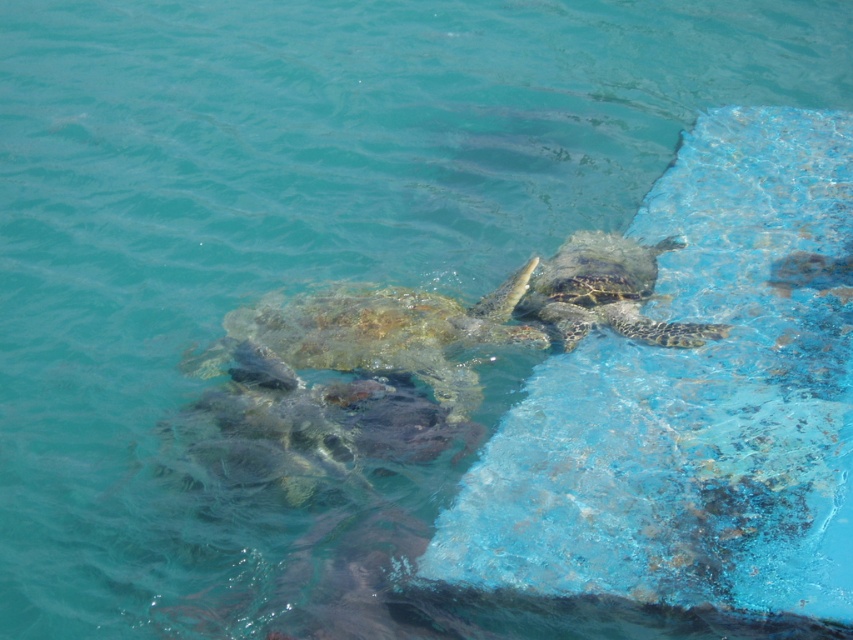
You are a marine biologist observing the turtles in the scene. You need to locate the rusty brown shell at center for a study. What are its coordinates?

The coordinates of the rusty brown shell at center are at point (381, 333).

You are a marine biologist observing the turtles from a boat anchored 5 meters away from the rusty brown shell at center. Can you safely approach the turtle to take a closer look without disturbing it?

The rusty brown shell at center is 4.70 meters away from the camera. Since the boat is anchored 5 meters away, you are already within a safe distance to observe the turtle without disturbing it. However, approaching closer than 4.70 meters might startle the turtle.